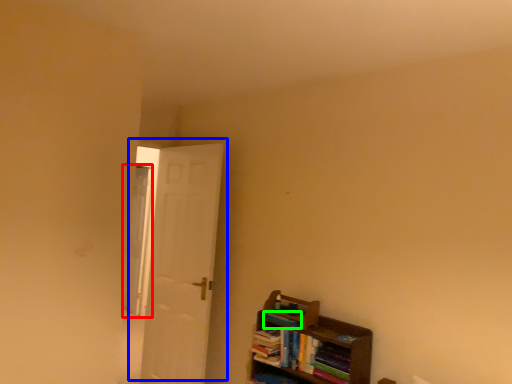
Question: Which is farther away from window (highlighted by a red box)? door (highlighted by a blue box) or book (highlighted by a green box)?

Choices:
 (A) door
 (B) book

Answer: (B)